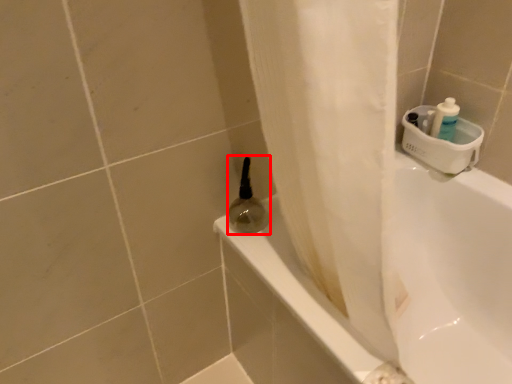
Question: From the image's perspective, what is the correct spatial relationship of mouthwash (annotated by the red box) in relation to bathtub?

Choices:
 (A) above
 (B) below

Answer: (A)